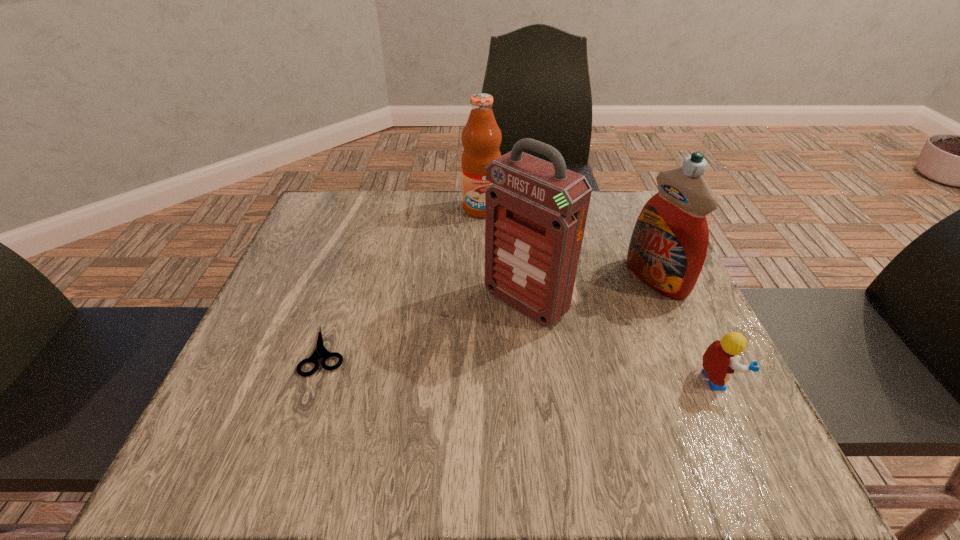
You are a GUI agent. You are given a task and a screenshot of the screen. Output one action in this format:
    pyautogui.click(x=<x>, y=<y>)
    Task: Click on the shears
    This screenshot has width=960, height=540.
    Given the screenshot: What is the action you would take?
    pyautogui.click(x=320, y=351)

Find the location of a particular element. the shortest object is located at coordinates (320, 351).

Locate an element on the screen. The image size is (960, 540). the fourth tallest object is located at coordinates (720, 360).

This screenshot has height=540, width=960. Identify the location of detergent. (668, 247).

At what (x,y) coordinates should I click in order to perform the action: click on the farthest object. Please return your answer as a coordinate pair (x, y). This screenshot has height=540, width=960. Looking at the image, I should click on (481, 137).

Locate an element on the screen. the tallest object is located at coordinates (535, 211).

I want to click on vacant space located on the back of the shortest object, so click(x=361, y=244).

Identify the location of vacant space situated on the front surface of the detergent. (566, 326).

The height and width of the screenshot is (540, 960). I want to click on vacant space located on the front surface of the detergent, so click(x=494, y=362).

Find the location of a particular element. This screenshot has width=960, height=540. free space located 0.090m on the front surface of the detergent is located at coordinates (608, 306).